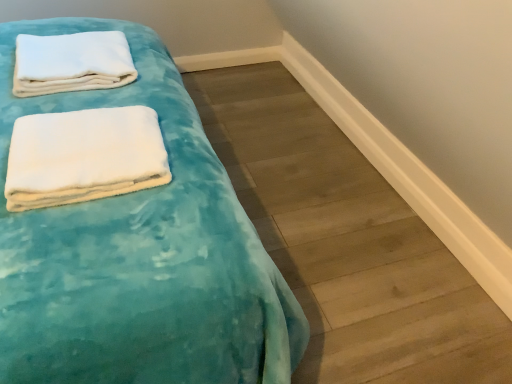
Question: From a real-world perspective, is white soft towel at upper left, placed as the 2th towel when sorted from front to back, positioned under teal velvety blanket at upper left based on gravity?

Choices:
 (A) yes
 (B) no

Answer: (B)

Question: Is white soft towel at upper left, placed as the 2th towel when sorted from front to back, smaller than teal velvety blanket at upper left?

Choices:
 (A) yes
 (B) no

Answer: (A)

Question: Does white soft towel at upper left, which ranks as the first towel in top-to-bottom order, have a lesser width compared to teal velvety blanket at upper left?

Choices:
 (A) no
 (B) yes

Answer: (B)

Question: Can you confirm if white soft towel at upper left, positioned as the 1th towel in back-to-front order, is positioned to the left of teal velvety blanket at upper left?

Choices:
 (A) yes
 (B) no

Answer: (A)

Question: Is teal velvety blanket at upper left located within white soft towel at upper left, positioned as the 1th towel in back-to-front order?

Choices:
 (A) no
 (B) yes

Answer: (A)

Question: Would you say white soft towel at upper left, placed as the 2th towel when sorted from front to back, is inside or outside white soft towel at upper left, the 2th towel when ordered from top to bottom?

Choices:
 (A) outside
 (B) inside

Answer: (A)

Question: Would you say white soft towel at upper left, positioned as the 1th towel in back-to-front order, is to the left or to the right of white soft towel at upper left, the second towel when ordered from back to front, in the picture?

Choices:
 (A) left
 (B) right

Answer: (A)

Question: From the image's perspective, is white soft towel at upper left, which ranks as the first towel in top-to-bottom order, above or below white soft towel at upper left, the 1th towel in the front-to-back sequence?

Choices:
 (A) above
 (B) below

Answer: (A)

Question: Considering the positions of white soft towel at upper left, positioned as the 1th towel in back-to-front order, and white soft towel at upper left, the 2th towel when ordered from top to bottom, in the image, is white soft towel at upper left, positioned as the 1th towel in back-to-front order, taller or shorter than white soft towel at upper left, the 2th towel when ordered from top to bottom,?

Choices:
 (A) tall
 (B) short

Answer: (A)

Question: Considering their positions, is teal velvety bed at left located in front of or behind white soft towel at upper left, the 1th towel in the front-to-back sequence?

Choices:
 (A) behind
 (B) front

Answer: (B)

Question: In terms of width, does teal velvety bed at left look wider or thinner when compared to white soft towel at upper left, positioned as the first towel in bottom-to-top order?

Choices:
 (A) thin
 (B) wide

Answer: (B)

Question: Would you say teal velvety bed at left is inside or outside white soft towel at upper left, the 2th towel when ordered from top to bottom?

Choices:
 (A) inside
 (B) outside

Answer: (B)

Question: Is teal velvety bed at left bigger or smaller than white soft towel at upper left, positioned as the first towel in bottom-to-top order?

Choices:
 (A) big
 (B) small

Answer: (A)

Question: In terms of width, does white soft towel at upper left, positioned as the 1th towel in back-to-front order, look wider or thinner when compared to teal velvety bed at left?

Choices:
 (A) wide
 (B) thin

Answer: (B)

Question: Is white soft towel at upper left, positioned as the 1th towel in back-to-front order, taller or shorter than teal velvety bed at left?

Choices:
 (A) short
 (B) tall

Answer: (A)